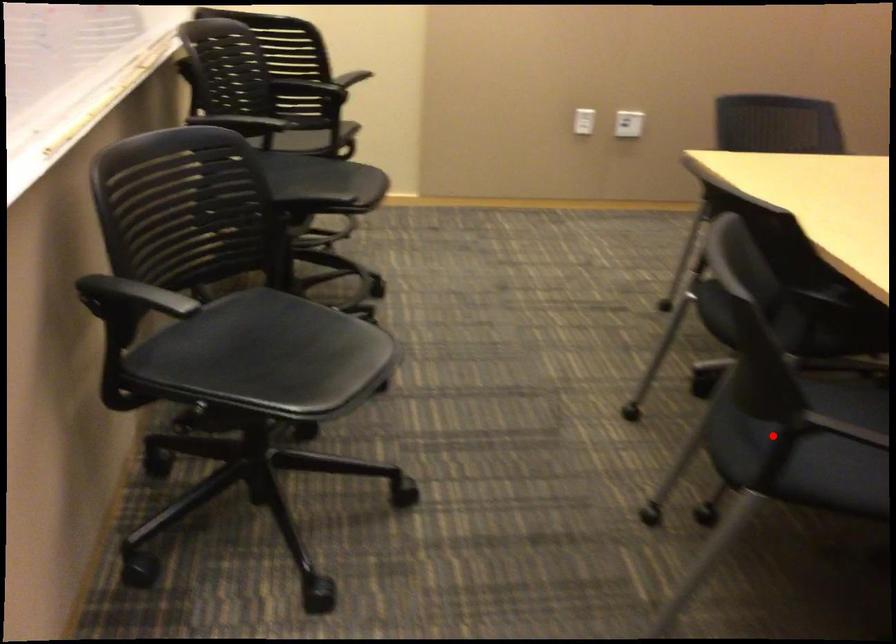
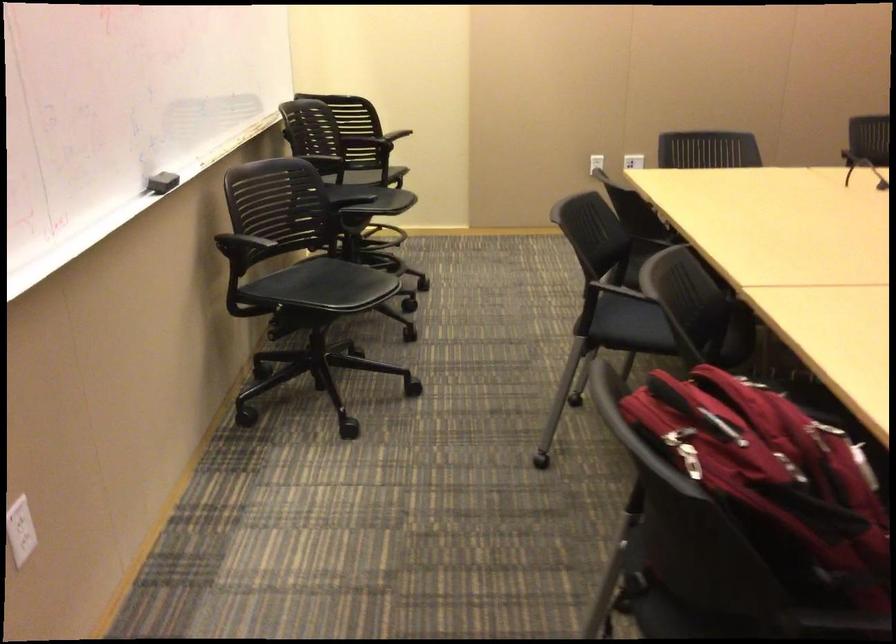
Question: I am providing you with two images of the same scene from different viewpoints. In image1, a red point is highlighted. Considering the same 3D point in image2, which of the following is correct?

Choices:
 (A) It is closer
 (B) It is farther

Answer: (B)